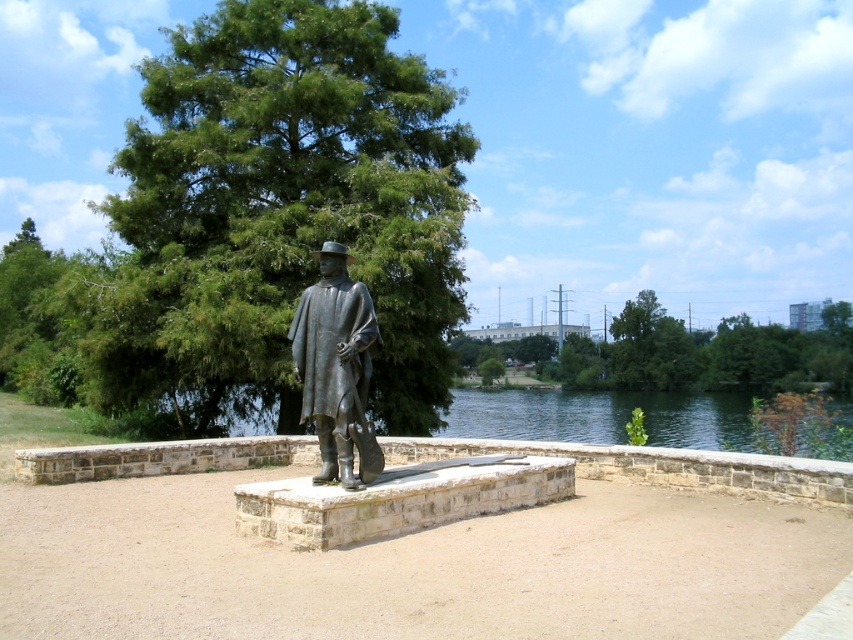
You are standing in the outdoor scene and want to take a photo of the green leafy tree at center. Where should you position yourself to capture it in the center of your camera view?

To capture the green leafy tree at center in the center of your camera view, position yourself directly in front of it since it is located at point (283, 209) in the 2D image plane.

You are a park visitor standing at the bronze statue at center. You want to take a photo of the green leafy tree at upper center. Can you see the entire tree in your camera frame without moving your position? Please explain.

The green leafy tree at upper center is 51.99 meters away from the bronze statue at center. At this distance, it is likely that the entire tree can be captured in the camera frame without needing to move, as the tree is relatively small compared to the distance between them.